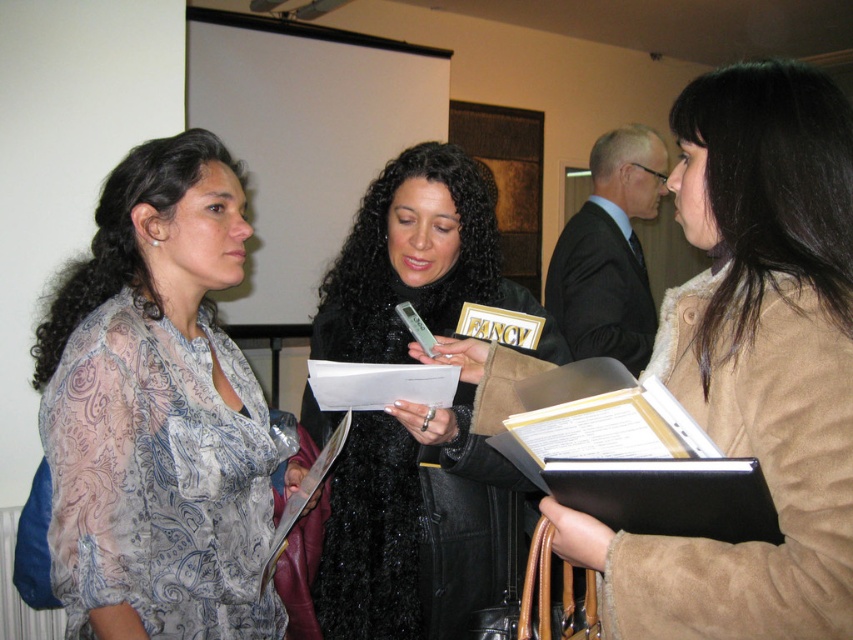
Does suede beige coat at right appear over black fuzzy coat at center?

Correct, suede beige coat at right is located above black fuzzy coat at center.

Which is below, suede beige coat at right or black fuzzy coat at center?

black fuzzy coat at center

What do you see at coordinates (752, 364) in the screenshot?
I see `suede beige coat at right` at bounding box center [752, 364].

This screenshot has height=640, width=853. I want to click on suede beige coat at right, so click(x=752, y=364).

Does point (178, 248) come behind point (432, 556)?

No, (178, 248) is in front of (432, 556).

Is point (169, 333) in front of point (331, 600)?

Yes, point (169, 333) is closer to viewer.

The height and width of the screenshot is (640, 853). What are the coordinates of `translucent floral blouse at center` in the screenshot? It's located at (157, 410).

Does point (778, 189) come behind point (120, 253)?

No.

Does suede beige coat at right appear on the right side of translucent floral blouse at center?

Indeed, suede beige coat at right is positioned on the right side of translucent floral blouse at center.

Between point (788, 490) and point (192, 349), which one is positioned in front?

Point (788, 490)

Image resolution: width=853 pixels, height=640 pixels. Identify the location of suede beige coat at right. (752, 364).